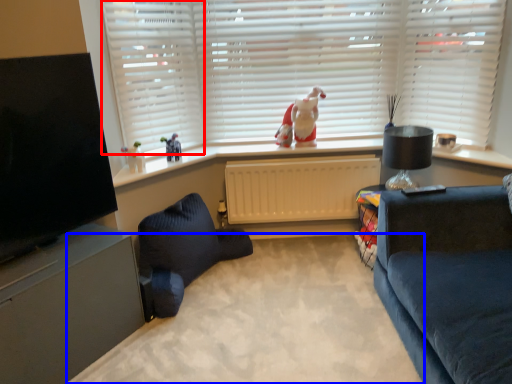
Question: Among these objects, which one is nearest to the camera, shutter (highlighted by a red box) or plain (highlighted by a blue box)?

Choices:
 (A) shutter
 (B) plain

Answer: (B)